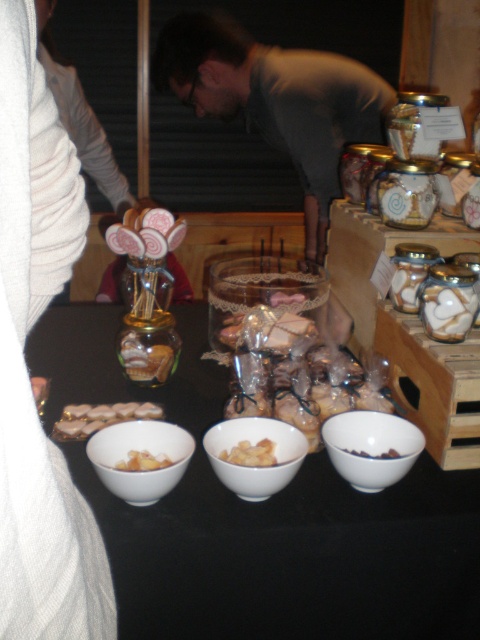
You are a customer at the market stall and want to place an order. You have a small gift box that is the same size as the brown matte bowl at center. Can you fit the gift box into the space currently occupied by the white sweater at lower left?

The white sweater at lower left is larger in size than the brown matte bowl at center. Since the gift box is the same size as the brown matte bowl at center, it can fit into the space currently occupied by the white sweater at lower left because the sweater takes up more space.

You are a customer at the market stall and want to buy both the white sweater at lower left and the yellow matte dried fruits at center. The cashier asks you to place the items on the counter. Which item should you place first to ensure that the smaller item doesn

The yellow matte dried fruits at center are smaller than the white sweater at lower left, so you should place the yellow matte dried fruits at center first to avoid it being covered or hidden by the larger item.